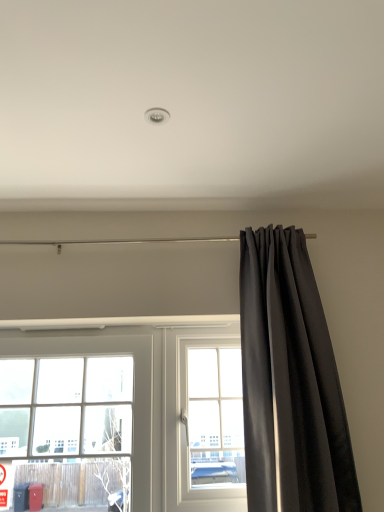
Question: From a real-world perspective, is black velvet curtain at right located higher than clear glass window at left, the first window when ordered from left to right?

Choices:
 (A) yes
 (B) no

Answer: (A)

Question: Does black velvet curtain at right have a lesser width compared to clear glass window at left, the 2th window positioned from the right?

Choices:
 (A) no
 (B) yes

Answer: (A)

Question: Is black velvet curtain at right outside of clear glass window at left, the first window when ordered from left to right?

Choices:
 (A) yes
 (B) no

Answer: (A)

Question: Does black velvet curtain at right have a greater height compared to clear glass window at left, the 2th window positioned from the right?

Choices:
 (A) no
 (B) yes

Answer: (B)

Question: Can you confirm if black velvet curtain at right is positioned to the right of clear glass window at left, the 2th window positioned from the right?

Choices:
 (A) yes
 (B) no

Answer: (A)

Question: Is black velvet curtain at right next to clear glass window at left, the first window when ordered from left to right?

Choices:
 (A) no
 (B) yes

Answer: (A)

Question: Considering the relative sizes of clear glass window at center, which ranks as the first window in right-to-left order, and black velvet curtain at right in the image provided, is clear glass window at center, which ranks as the first window in right-to-left order, smaller than black velvet curtain at right?

Choices:
 (A) yes
 (B) no

Answer: (A)

Question: Is clear glass window at center, arranged as the 2th window when viewed from the left, taller than black velvet curtain at right?

Choices:
 (A) no
 (B) yes

Answer: (A)

Question: From the image's perspective, is clear glass window at center, which ranks as the first window in right-to-left order, beneath black velvet curtain at right?

Choices:
 (A) yes
 (B) no

Answer: (A)

Question: Is clear glass window at center, which ranks as the first window in right-to-left order, oriented towards black velvet curtain at right?

Choices:
 (A) no
 (B) yes

Answer: (A)

Question: Considering the relative positions of clear glass window at center, arranged as the 2th window when viewed from the left, and black velvet curtain at right in the image provided, is clear glass window at center, arranged as the 2th window when viewed from the left, to the left of black velvet curtain at right from the viewer's perspective?

Choices:
 (A) no
 (B) yes

Answer: (B)

Question: Can you confirm if clear glass window at center, which ranks as the first window in right-to-left order, is bigger than black velvet curtain at right?

Choices:
 (A) yes
 (B) no

Answer: (B)

Question: Considering the relative sizes of clear glass window at center, which ranks as the first window in right-to-left order, and clear glass window at left, the 2th window positioned from the right, in the image provided, is clear glass window at center, which ranks as the first window in right-to-left order, bigger than clear glass window at left, the 2th window positioned from the right,?

Choices:
 (A) yes
 (B) no

Answer: (B)